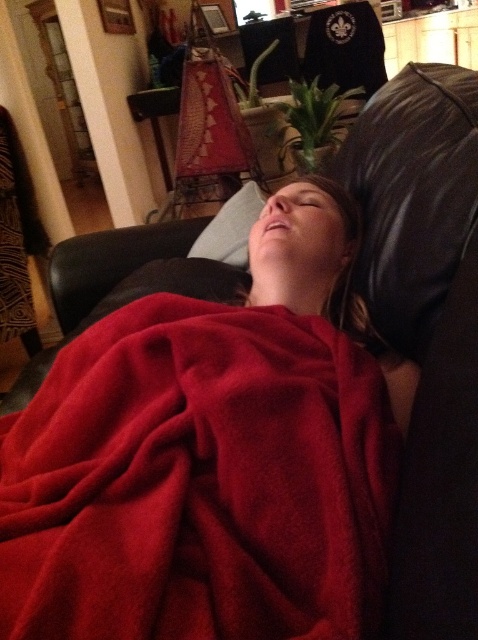
You are a housekeeper entering the room and see the red fleece blanket at lower left and the velvety red robe at lower left. Which item is closer to the floor?

The red fleece blanket at lower left is positioned under the velvety red robe at lower left, so the red fleece blanket at lower left is closer to the floor.